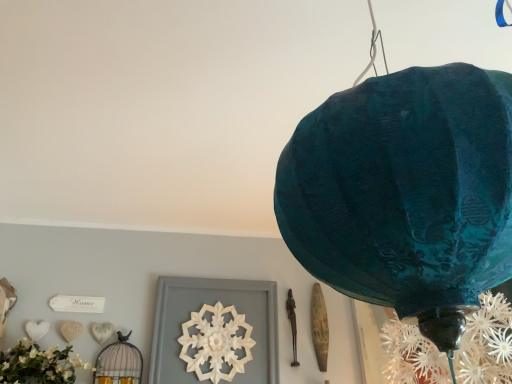
Question: Is white carved wood at center positioned beyond the bounds of matte black birdcage at lower left?

Choices:
 (A) no
 (B) yes

Answer: (B)

Question: From the image's perspective, would you say white carved wood at center is positioned over matte black birdcage at lower left?

Choices:
 (A) no
 (B) yes

Answer: (B)

Question: Is matte black birdcage at lower left completely or partially inside white carved wood at center?

Choices:
 (A) no
 (B) yes

Answer: (A)

Question: Can you confirm if white carved wood at center is thinner than matte black birdcage at lower left?

Choices:
 (A) no
 (B) yes

Answer: (B)

Question: Are white carved wood at center and matte black birdcage at lower left located far from each other?

Choices:
 (A) no
 (B) yes

Answer: (A)

Question: Does white carved wood at center have a larger size compared to matte black birdcage at lower left?

Choices:
 (A) yes
 (B) no

Answer: (A)

Question: Considering the relative sizes of white carved wood at center and teal paper lantern at upper right in the image provided, is white carved wood at center smaller than teal paper lantern at upper right?

Choices:
 (A) yes
 (B) no

Answer: (A)

Question: Can teal paper lantern at upper right be found inside white carved wood at center?

Choices:
 (A) no
 (B) yes

Answer: (A)

Question: Could you tell me if white carved wood at center is turned towards teal paper lantern at upper right?

Choices:
 (A) yes
 (B) no

Answer: (A)

Question: Can you confirm if white carved wood at center is positioned to the left of teal paper lantern at upper right?

Choices:
 (A) no
 (B) yes

Answer: (B)

Question: Is white carved wood at center not near teal paper lantern at upper right?

Choices:
 (A) no
 (B) yes

Answer: (B)

Question: From the image's perspective, is white carved wood at center located beneath teal paper lantern at upper right?

Choices:
 (A) yes
 (B) no

Answer: (A)

Question: Is teal paper lantern at upper right touching matte black birdcage at lower left?

Choices:
 (A) no
 (B) yes

Answer: (A)